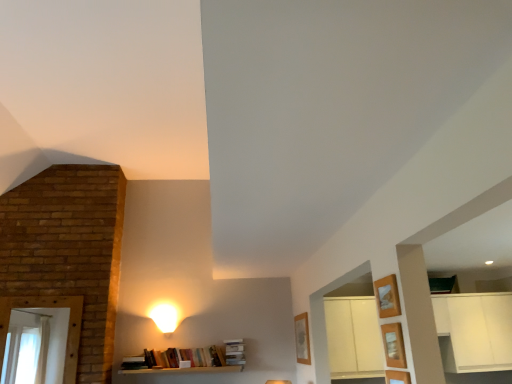
Question: Is wooden shelf at lower right, which is the 2th shelf in bottom-to-top order, bigger or smaller than matte white lampshade at upper center?

Choices:
 (A) small
 (B) big

Answer: (A)

Question: Considering the positions of point (389, 337) and point (175, 321), is point (389, 337) closer or farther from the camera than point (175, 321)?

Choices:
 (A) closer
 (B) farther

Answer: (A)

Question: Which of these objects is positioned closest to the wooden shelf at lower right, which is counted as the second shelf, starting from the top?

Choices:
 (A) wooden frame at upper right, which ranks as the first shelf in top-to-bottom order
 (B) wooden shelf at lower right, placed as the 3th shelf when sorted from top to bottom
 (C) matte white lampshade at upper center

Answer: (B)

Question: Estimate the real-world distances between objects in this image. Which object is closer to the wooden shelf at lower right, which is counted as the second shelf, starting from the top?

Choices:
 (A) wooden shelf at lower right, the first shelf positioned from the bottom
 (B) matte white lampshade at upper center
 (C) wooden frame at upper right, acting as the 3th shelf starting from the bottom

Answer: (A)